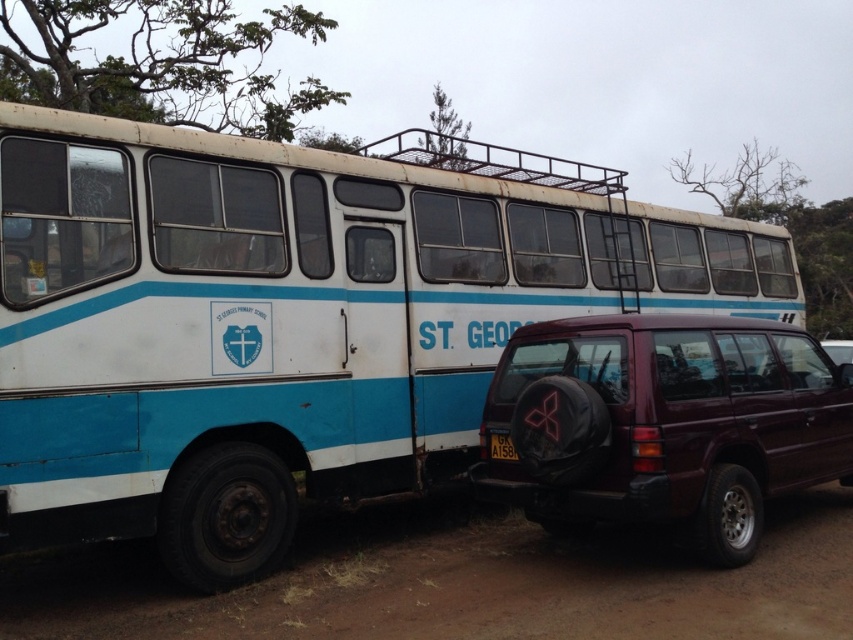
Question: Estimate the real-world distances between objects in this image. Which object is closer to the brown dirt track at lower center?

Choices:
 (A) bare branches at upper center
 (B) green leafy tree at upper center
 (C) green leafy tree at upper left

Answer: (B)

Question: Is the position of maroon matte suv at lower right less distant than that of maroon matte suv at center?

Choices:
 (A) yes
 (B) no

Answer: (A)

Question: Is brown dirt track at lower center positioned in front of bare branches at upper center?

Choices:
 (A) yes
 (B) no

Answer: (A)

Question: Can you confirm if white matte bus at center is smaller than black plastic license plate at lower center?

Choices:
 (A) yes
 (B) no

Answer: (B)

Question: Which point is farther from the camera taking this photo?

Choices:
 (A) (409, 532)
 (B) (260, 230)
 (C) (144, 42)
 (D) (734, 161)

Answer: (D)

Question: Which object is closer to the camera taking this photo?

Choices:
 (A) brown dirt track at lower center
 (B) green leafy tree at upper left
 (C) white matte bus at center

Answer: (A)